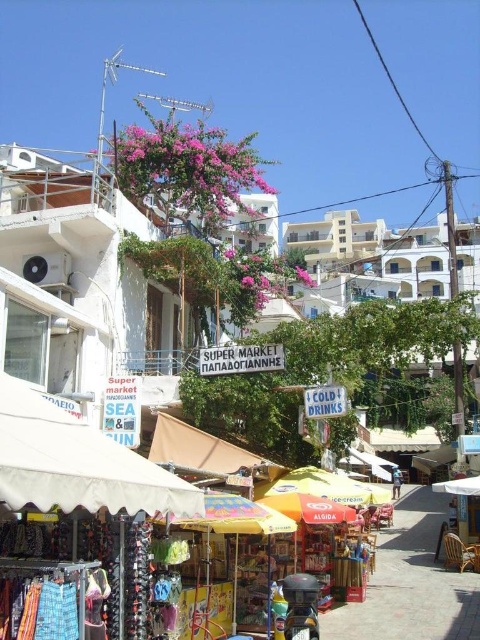
Question: Among these objects, which one is farthest from the camera?

Choices:
 (A) white fabric canopy at lower left
 (B) yellow fabric umbrella at center

Answer: (B)

Question: Where is white fabric canopy at lower left located in relation to yellow fabric umbrella at center in the image?

Choices:
 (A) right
 (B) left

Answer: (B)

Question: Is white fabric canopy at lower left bigger than yellow fabric umbrella at center?

Choices:
 (A) no
 (B) yes

Answer: (B)

Question: Among these objects, which one is nearest to the camera?

Choices:
 (A) white fabric canopy at lower left
 (B) yellow fabric umbrella at center

Answer: (A)

Question: Can you confirm if white fabric canopy at lower left is thinner than yellow fabric umbrella at center?

Choices:
 (A) no
 (B) yes

Answer: (A)